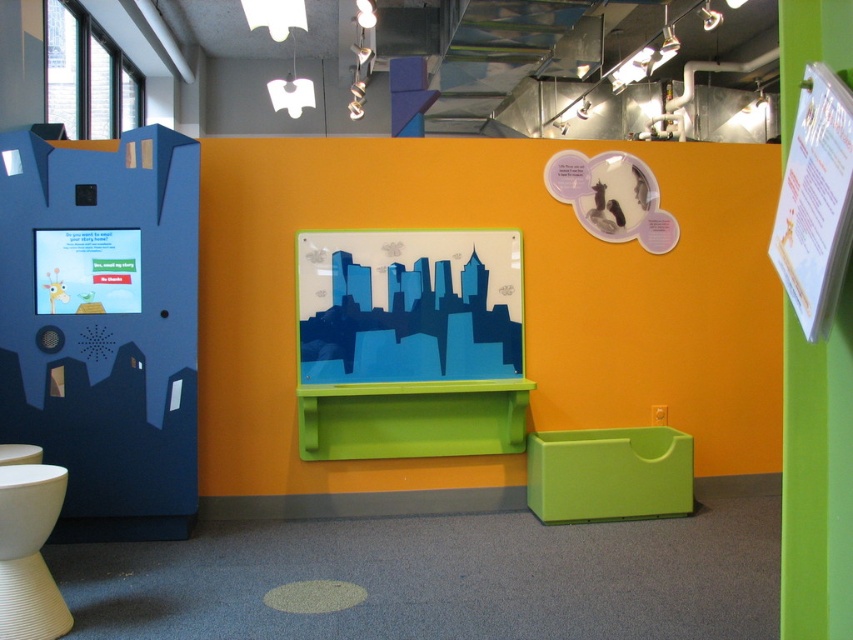
Question: Which object is closer to the camera taking this photo?

Choices:
 (A) white matte toilet bowl at lower left
 (B) blue glossy cityscape at center

Answer: (A)

Question: Which object appears closest to the camera in this image?

Choices:
 (A) blue glossy cityscape at center
 (B) white matte toilet bowl at lower left

Answer: (B)

Question: Is blue glossy cityscape at center smaller than white matte toilet bowl at lower left?

Choices:
 (A) no
 (B) yes

Answer: (A)

Question: Considering the relative positions of blue glossy cityscape at center and white matte toilet bowl at lower left in the image provided, where is blue glossy cityscape at center located with respect to white matte toilet bowl at lower left?

Choices:
 (A) right
 (B) left

Answer: (A)

Question: Is blue glossy cityscape at center further to camera compared to white matte toilet bowl at lower left?

Choices:
 (A) yes
 (B) no

Answer: (A)